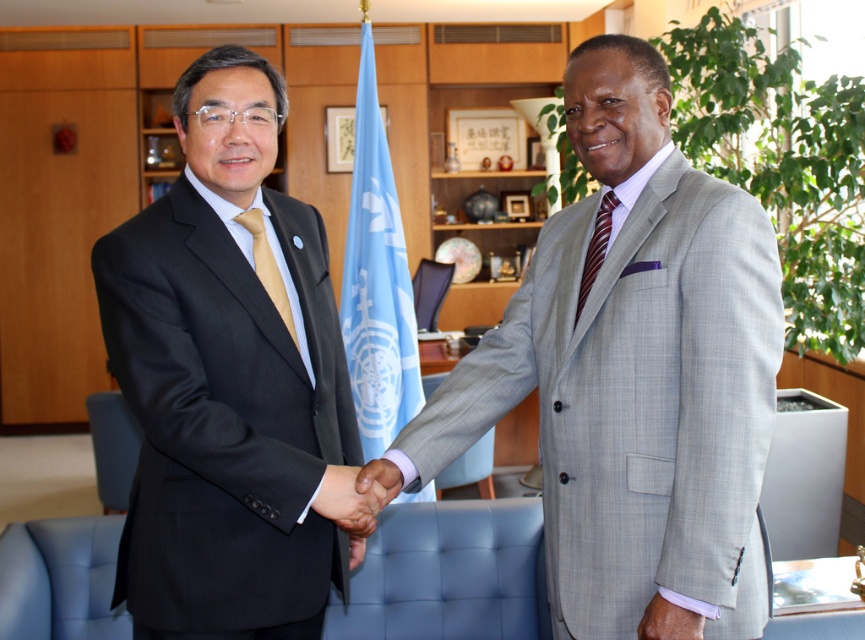
Describe the element at coordinates (227, 378) in the screenshot. The width and height of the screenshot is (865, 640). I see `matte black suit at center` at that location.

Is point (203, 563) farther from viewer compared to point (271, 292)?

That is False.

Image resolution: width=865 pixels, height=640 pixels. I want to click on matte black suit at center, so click(x=227, y=378).

This screenshot has height=640, width=865. Identify the location of matte black suit at center. (227, 378).

Consider the image. Is light blue fabric flag at center to the left of pink fabric wristband at lower right from the viewer's perspective?

Indeed, light blue fabric flag at center is positioned on the left side of pink fabric wristband at lower right.

Who is more forward, [392,308] or [664,618]?

Point [664,618] is in front.

Between point (361, 356) and point (646, 637), which one is positioned in front?

Point (646, 637)

Locate an element on the screen. The width and height of the screenshot is (865, 640). light blue fabric flag at center is located at coordinates (376, 280).

Who is higher up, smooth skin handshake at center or pink fabric wristband at lower right?

smooth skin handshake at center is above.

Can you confirm if smooth skin handshake at center is taller than pink fabric wristband at lower right?

Indeed, smooth skin handshake at center has a greater height compared to pink fabric wristband at lower right.

You are a GUI agent. You are given a task and a screenshot of the screen. Output one action in this format:
    pyautogui.click(x=<x>, y=<y>)
    Task: Click on the smooth skin handshake at center
    
    Given the screenshot: What is the action you would take?
    pyautogui.click(x=356, y=496)